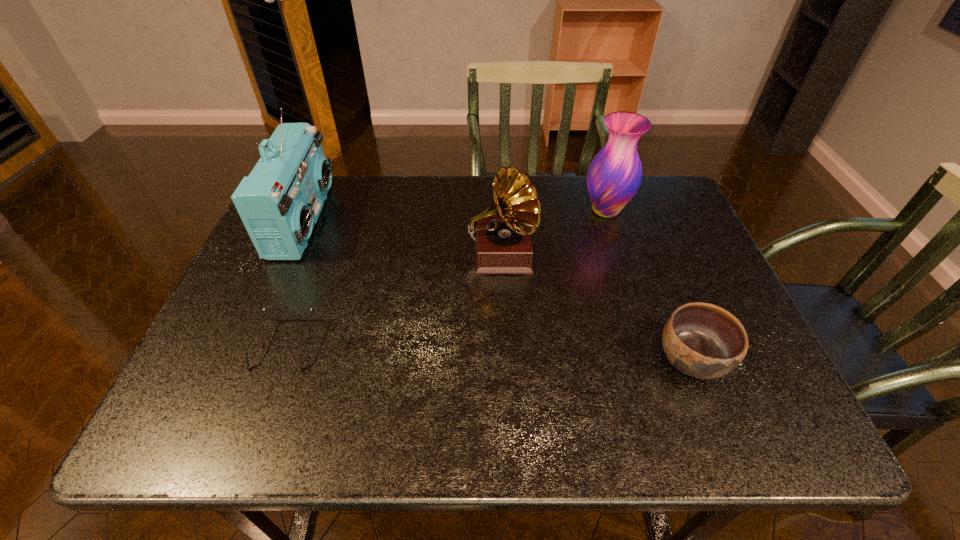
Identify the location of radio receiver. point(280,201).

You are a GUI agent. You are given a task and a screenshot of the screen. Output one action in this format:
    pyautogui.click(x=<x>, y=<y>)
    Task: Click on the vase
    The width and height of the screenshot is (960, 540).
    Given the screenshot: What is the action you would take?
    pyautogui.click(x=614, y=175)

Where is `the third object from left to right`? the third object from left to right is located at coordinates (503, 246).

Locate an element on the screen. the second shortest object is located at coordinates (702, 340).

You are a GUI agent. You are given a task and a screenshot of the screen. Output one action in this format:
    pyautogui.click(x=<x>, y=<y>)
    Task: Click on the spectacles
    
    Given the screenshot: What is the action you would take?
    pyautogui.click(x=264, y=308)

Locate an element on the screen. free spot located on the front-facing side of the radio receiver is located at coordinates (414, 220).

Locate an element on the screen. The width and height of the screenshot is (960, 540). free space located 0.400m on the front of the vase is located at coordinates (649, 345).

Where is `vacant space situated 0.230m from the horn of the phonograph record`? The width and height of the screenshot is (960, 540). vacant space situated 0.230m from the horn of the phonograph record is located at coordinates (508, 374).

You are a GUI agent. You are given a task and a screenshot of the screen. Output one action in this format:
    pyautogui.click(x=<x>, y=<y>)
    Task: Click on the free location located on the front of the second shortest object
    
    Given the screenshot: What is the action you would take?
    pyautogui.click(x=719, y=430)

Find the location of a particular element. vacant space located 0.060m with the lenses facing outward on the shortest object is located at coordinates (265, 398).